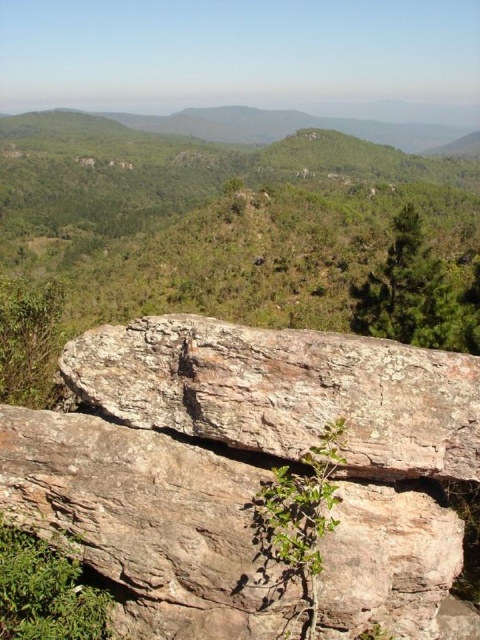
Question: Does rusty rock at center have a smaller size compared to green textured tree at upper right?

Choices:
 (A) yes
 (B) no

Answer: (A)

Question: Based on their relative distances, which object is farther from the rusty rock at center?

Choices:
 (A) green textured tree at upper right
 (B) rusty brown rock at center

Answer: (A)

Question: Which object is closer to the camera taking this photo?

Choices:
 (A) green textured tree at upper right
 (B) rusty rock at center
 (C) rusty brown rock at center

Answer: (B)

Question: From the image, what is the correct spatial relationship of rusty brown rock at center in relation to green textured tree at upper right?

Choices:
 (A) below
 (B) above

Answer: (A)

Question: Estimate the real-world distances between objects in this image. Which object is closer to the rusty rock at center?

Choices:
 (A) green textured tree at upper right
 (B) rusty brown rock at center

Answer: (B)

Question: Observing the image, what is the correct spatial positioning of rusty rock at center in reference to green textured tree at upper right?

Choices:
 (A) below
 (B) above

Answer: (A)